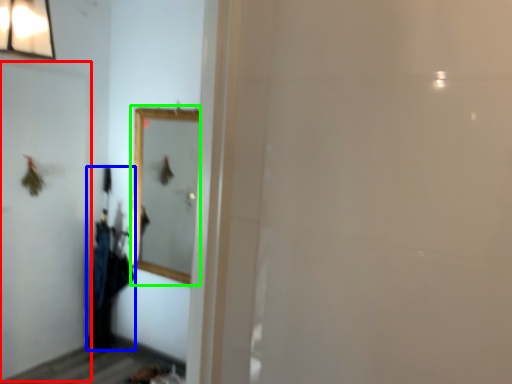
Question: Which is nearer to the screen door (highlighted by a red box)? laundry (highlighted by a blue box) or mirror (highlighted by a green box).

Choices:
 (A) laundry
 (B) mirror

Answer: (A)